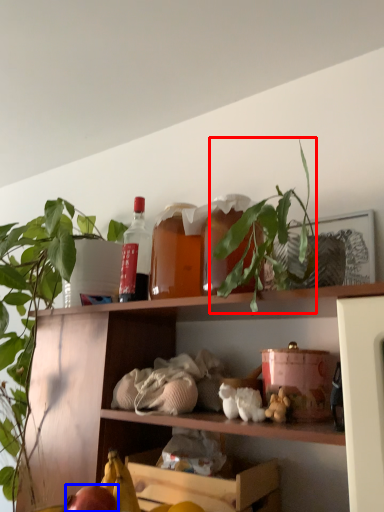
Question: Which of the following is the closest to the observer, plant (highlighted by a red box) or apple (highlighted by a blue box)?

Choices:
 (A) plant
 (B) apple

Answer: (A)